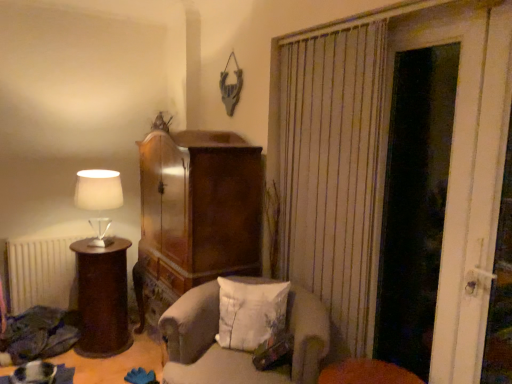
Question: Based on their positions, is white wooden door at right located to the left or right of light gray fabric chair at center?

Choices:
 (A) right
 (B) left

Answer: (A)

Question: Is white wooden door at right inside or outside of light gray fabric chair at center?

Choices:
 (A) inside
 (B) outside

Answer: (B)

Question: Which of these objects is positioned closest to the white wooden door at right?

Choices:
 (A) white matte radiator at lower left
 (B) white soft cushion at center
 (C) wooden side table at left
 (D) matte white lampshade at left
 (E) light gray fabric chair at center

Answer: (E)

Question: Estimate the real-world distances between objects in this image. Which object is closer to the wooden side table at left?

Choices:
 (A) light gray fabric chair at center
 (B) matte white lampshade at left
 (C) white matte radiator at lower left
 (D) white wooden door at right
 (E) white soft cushion at center

Answer: (C)